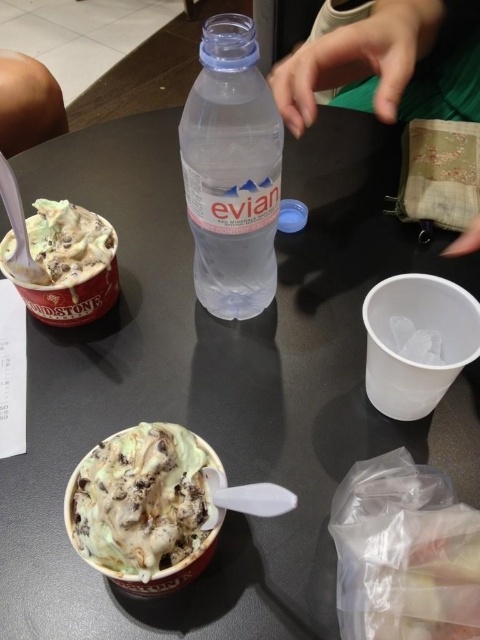
Can you confirm if green fabric pouch at upper right is positioned below green ice cream with chocolate chips at center?

Actually, green fabric pouch at upper right is above green ice cream with chocolate chips at center.

Which is more to the right, green fabric pouch at upper right or green ice cream with chocolate chips at center?

Positioned to the right is green fabric pouch at upper right.

Which is behind, point (361, 67) or point (148, 476)?

The point (361, 67) is more distant.

Find the location of a particular element. green fabric pouch at upper right is located at coordinates pos(388,65).

Is point (476, 243) positioned after point (113, 257)?

Yes, point (476, 243) is behind point (113, 257).

Which of these two, green fabric pouch at upper right or green mint chocolate chip ice cream at left, stands shorter?

green mint chocolate chip ice cream at left

At what (x,y) coordinates should I click in order to perform the action: click on green fabric pouch at upper right. Please return your answer as a coordinate pair (x, y). This screenshot has width=480, height=640. Looking at the image, I should click on (388, 65).

This screenshot has height=640, width=480. What do you see at coordinates (142, 502) in the screenshot? I see `green ice cream with chocolate chips at center` at bounding box center [142, 502].

Between point (199, 440) and point (38, 220), which one is positioned in front?

Point (199, 440) is more forward.

Locate an element on the screen. The image size is (480, 640). green ice cream with chocolate chips at center is located at coordinates (142, 502).